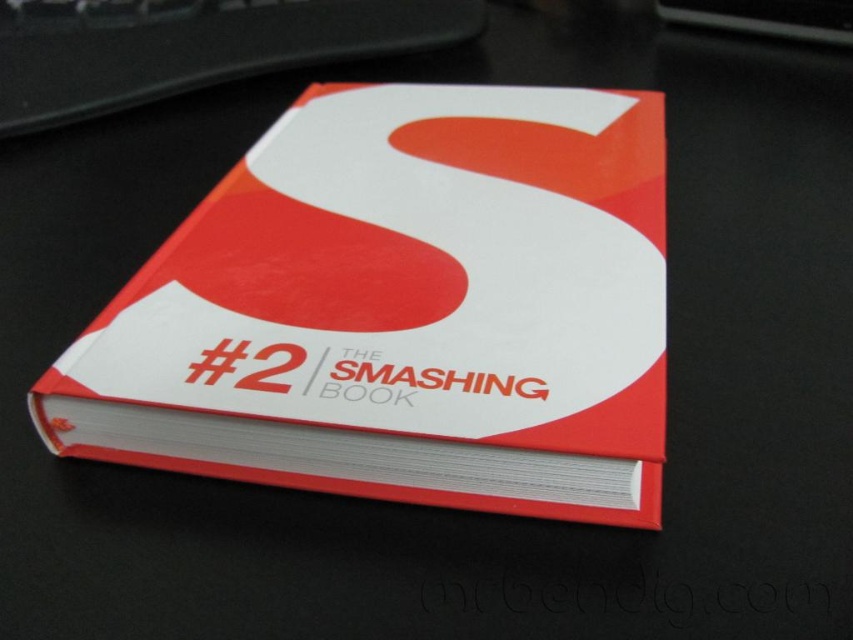
Does matte hardcover book at center have a larger size compared to black plastic keyboard at upper center?

Yes, matte hardcover book at center is bigger than black plastic keyboard at upper center.

Between matte hardcover book at center and black plastic keyboard at upper center, which one appears on the left side from the viewer's perspective?

From the viewer's perspective, black plastic keyboard at upper center appears more on the left side.

Identify the location of matte hardcover book at center. (403, 308).

This screenshot has width=853, height=640. I want to click on matte hardcover book at center, so click(x=403, y=308).